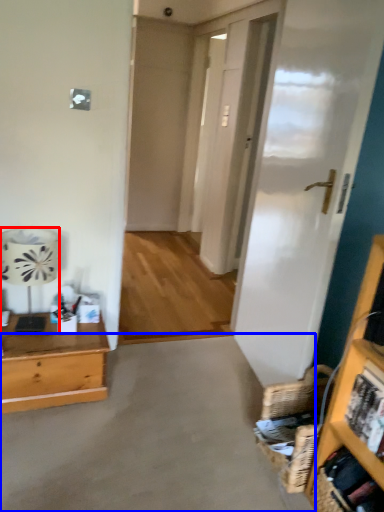
Question: Which object appears closest to the camera in this image, lamp (highlighted by a red box) or concrete (highlighted by a blue box)?

Choices:
 (A) lamp
 (B) concrete

Answer: (B)